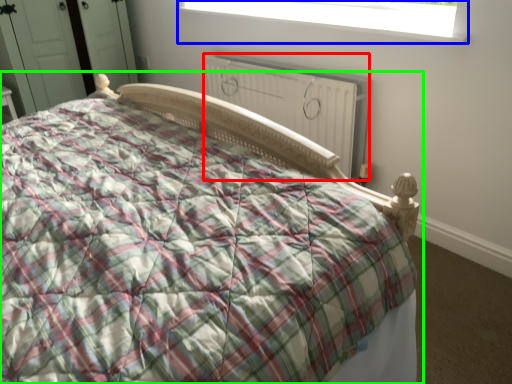
Question: Considering the real-world distances, which object is closest to radiator (highlighted by a red box)? window (highlighted by a blue box) or bed (highlighted by a green box).

Choices:
 (A) window
 (B) bed

Answer: (A)